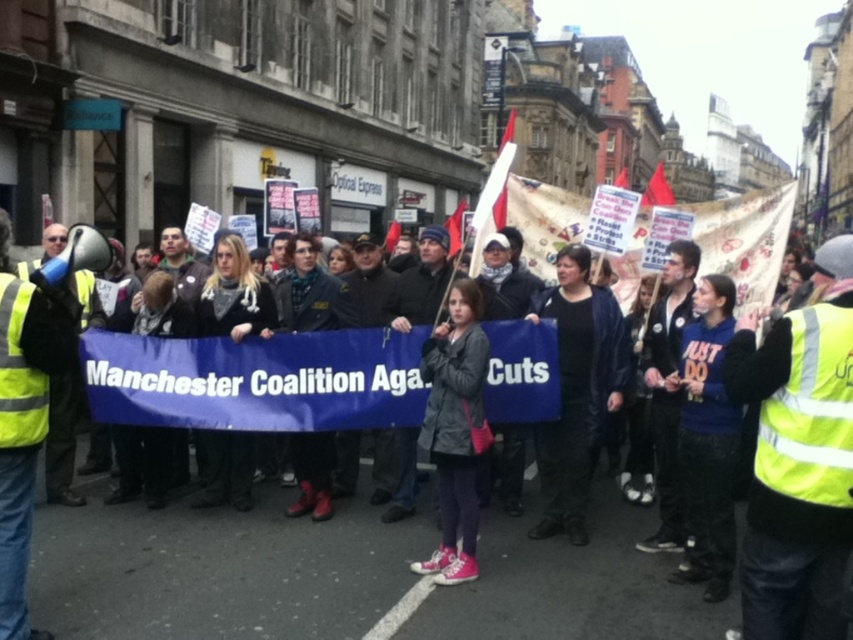
Question: Which of the following is the farthest from the observer?

Choices:
 (A) black leather jacket at center
 (B) yellow reflective vest at center

Answer: (A)

Question: Is the position of black leather jacket at center less distant than that of dark gray jacket at center?

Choices:
 (A) yes
 (B) no

Answer: (B)

Question: Among these points, which one is nearest to the camera?

Choices:
 (A) pyautogui.click(x=241, y=541)
 (B) pyautogui.click(x=573, y=371)
 (C) pyautogui.click(x=462, y=566)
 (D) pyautogui.click(x=753, y=337)

Answer: (D)

Question: Does matte black jacket at center come in front of dark gray jacket at center?

Choices:
 (A) no
 (B) yes

Answer: (B)

Question: From the image, what is the correct spatial relationship of matte black jacket at center in relation to yellow reflective vest at center?

Choices:
 (A) above
 (B) below

Answer: (B)

Question: Which object is farther from the camera taking this photo?

Choices:
 (A) dark gray jacket at center
 (B) yellow reflective vest at center

Answer: (A)